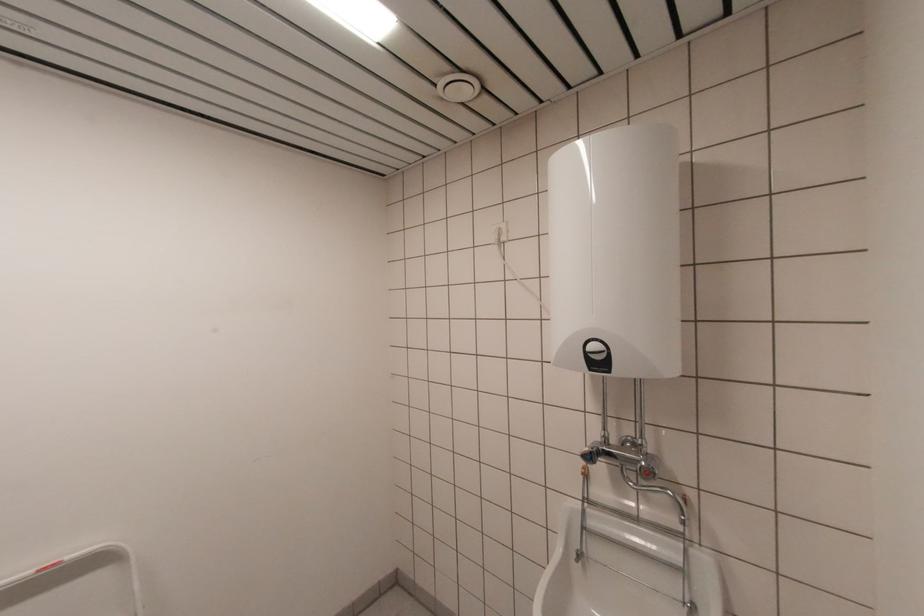
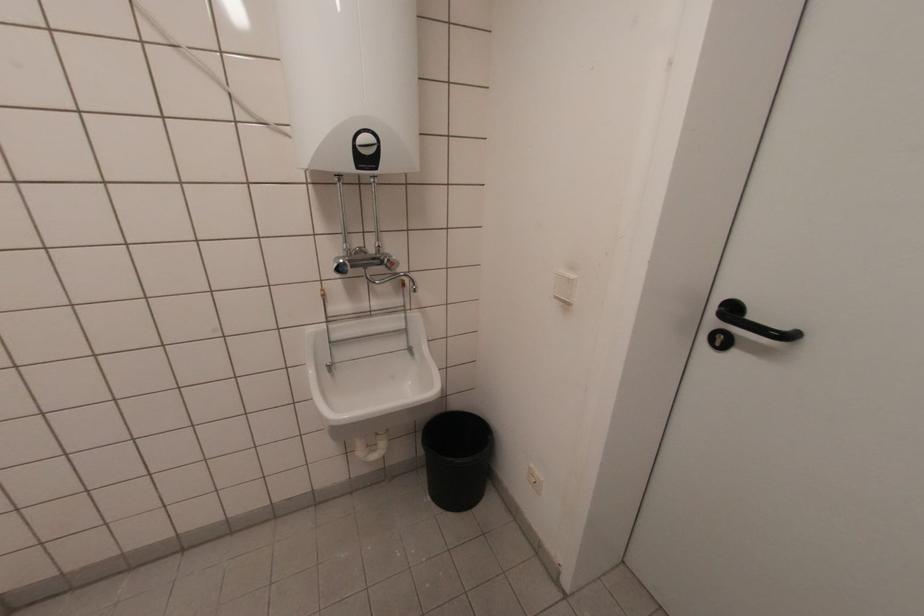
Where in the second image is the point corresponding to point (649, 455) from the first image?

(383, 254)